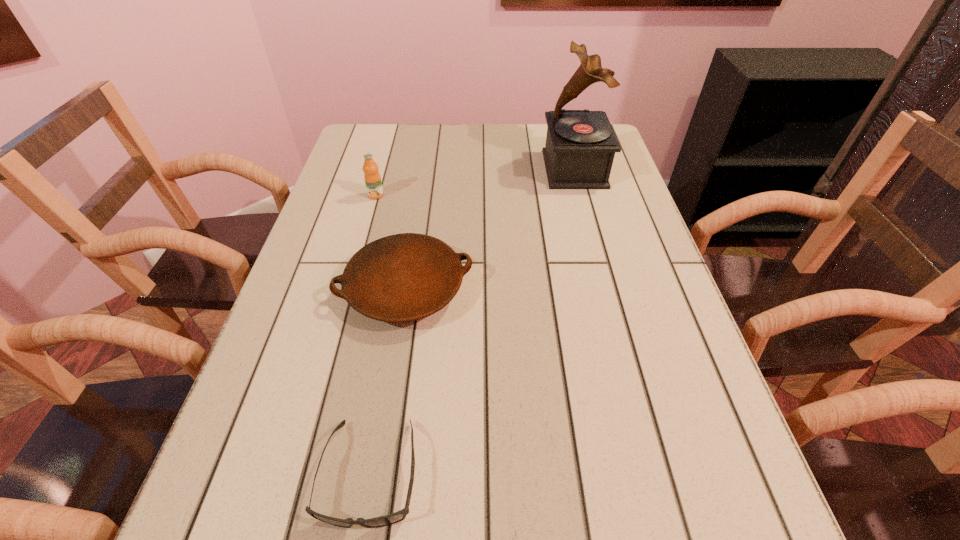
You are a GUI agent. You are given a task and a screenshot of the screen. Output one action in this format:
    pyautogui.click(x=<x>, y=<y>)
    Task: Click on the vacant area between the second nearest object and the shortest object
    
    Given the screenshot: What is the action you would take?
    pyautogui.click(x=388, y=381)

Identify the location of vacant area between the shortest object and the orange juice. The image size is (960, 540). (373, 334).

Identify the location of free space between the orange juice and the phonograph_record. The height and width of the screenshot is (540, 960). (475, 182).

Locate an element on the screen. Image resolution: width=960 pixels, height=540 pixels. vacant area between the nearest object and the third farthest object is located at coordinates (388, 381).

Identify the location of free space between the shortest object and the second nearest object. The width and height of the screenshot is (960, 540). (388, 381).

Locate which object ranks second in proximity to the sunglasses. Please provide its 2D coordinates. Your answer should be formatted as a tuple, i.e. [(x, y)], where the tuple contains the x and y coordinates of a point satisfying the conditions above.

[(372, 178)]

Find the location of a particular element. This screenshot has height=540, width=960. object that stands as the second closest to the nearest object is located at coordinates (372, 178).

This screenshot has height=540, width=960. In order to click on vacant area that satisfies the following two spatial constraints: 1. at the horn opening of the rightmost object; 2. on the front side of the plate in this screenshot , I will do `click(607, 289)`.

The height and width of the screenshot is (540, 960). Identify the location of vacant region that satisfies the following two spatial constraints: 1. on the label of the third farthest object; 2. on the right side of the third shortest object. (349, 289).

You are a GUI agent. You are given a task and a screenshot of the screen. Output one action in this format:
    pyautogui.click(x=<x>, y=<y>)
    Task: Click on the free spot that satisfies the following two spatial constraints: 1. at the horn opening of the farthest object; 2. on the label of the orange juice
    
    Given the screenshot: What is the action you would take?
    pyautogui.click(x=582, y=195)